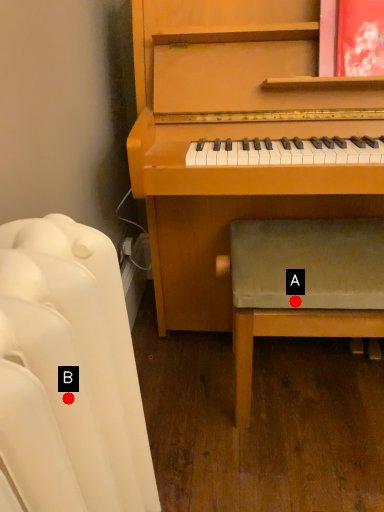
Question: Two points are circled on the image, labeled by A and B beside each circle. Which point appears farthest from the camera in this image?

Choices:
 (A) A is further
 (B) B is further

Answer: (A)